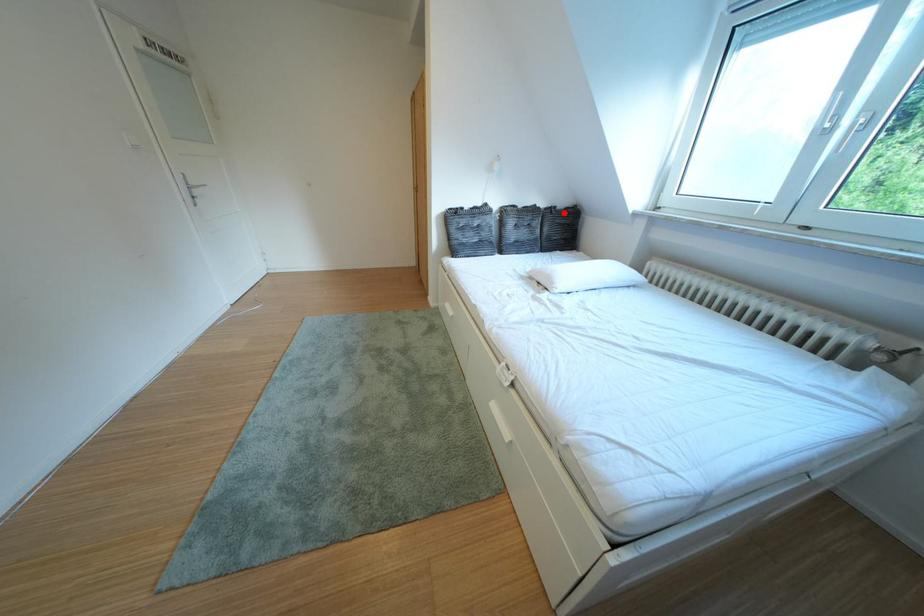
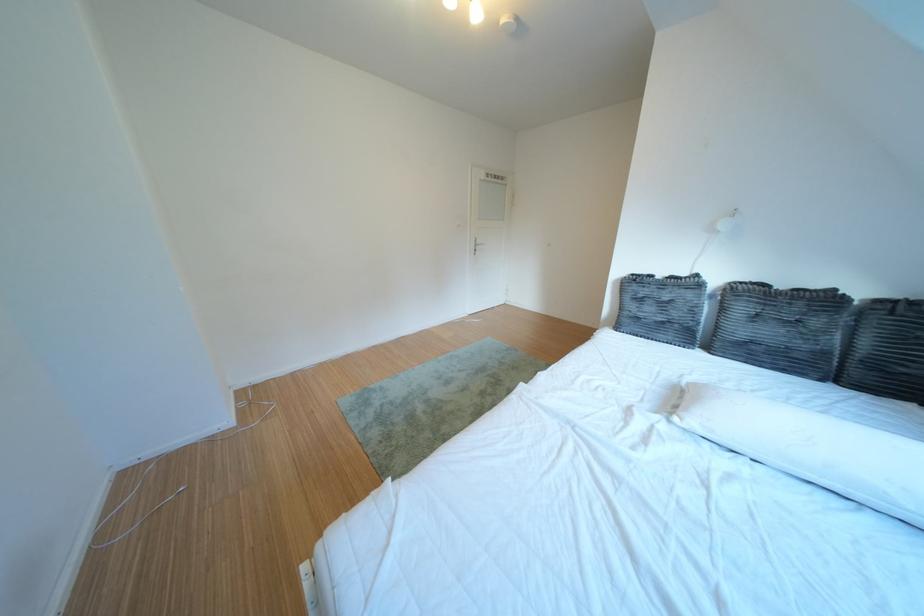
Find the pixel in the second image that matches the highlighted location in the first image.

(910, 306)